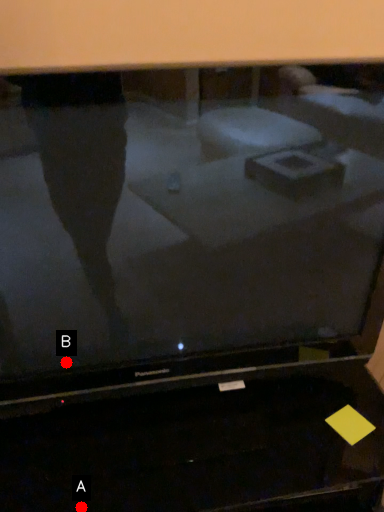
Question: Two points are circled on the image, labeled by A and B beside each circle. Which point appears farthest from the camera in this image?

Choices:
 (A) A is further
 (B) B is further

Answer: (B)